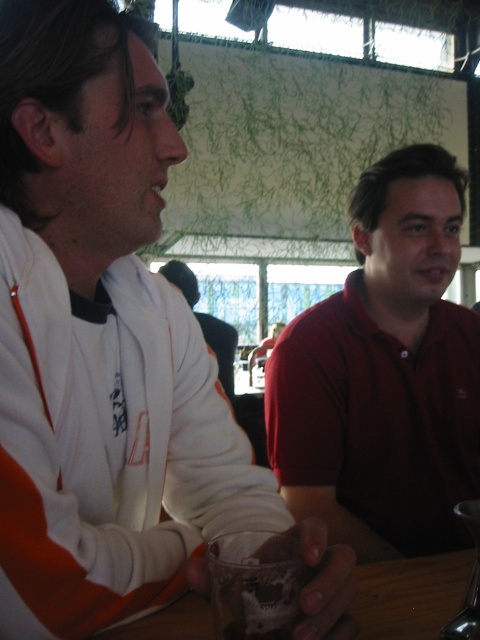
Question: Which of the following is the farthest from the observer?

Choices:
 (A) matte red shirt at right
 (B) matte white shirt at center

Answer: (B)

Question: Is matte red shirt at right bigger than matte white shirt at center?

Choices:
 (A) no
 (B) yes

Answer: (A)

Question: Can you confirm if matte red shirt at right is wider than matte white shirt at center?

Choices:
 (A) no
 (B) yes

Answer: (B)

Question: From the image, what is the correct spatial relationship of matte red shirt at right in relation to matte white shirt at center?

Choices:
 (A) above
 (B) below

Answer: (A)

Question: Which point appears closest to the camera in this image?

Choices:
 (A) (399, 360)
 (B) (191, 285)

Answer: (A)